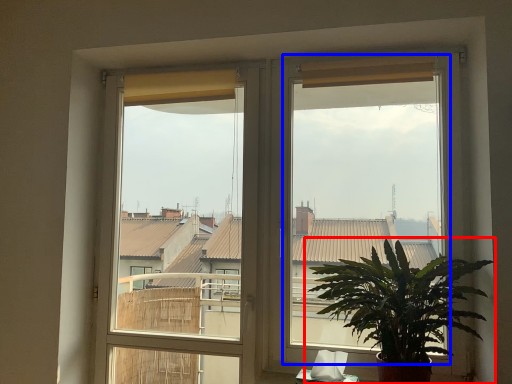
Question: Which object appears closest to the camera in this image, houseplant (highlighted by a red box) or window screen (highlighted by a blue box)?

Choices:
 (A) houseplant
 (B) window screen

Answer: (A)